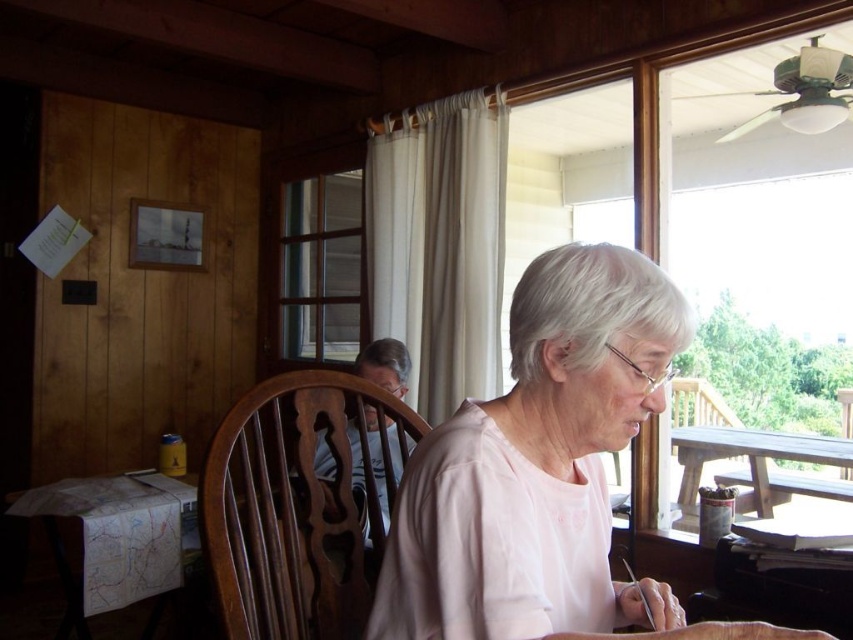
You are planning to place a small decorative item on the pink fabric at center and the wooden picnic table at right. Based on their sizes, which surface might be more suitable for placing multiple items without overcrowding?

The wooden picnic table at right has a greater width than the pink fabric at center, making it more suitable for placing multiple items without overcrowding.